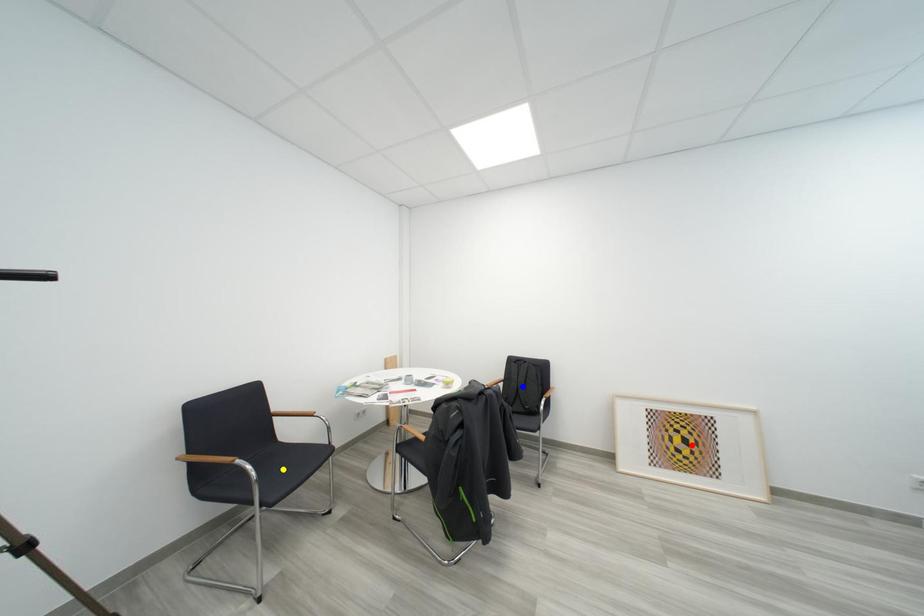
Order these from farthest to nearest:
red point
yellow point
blue point

blue point
red point
yellow point